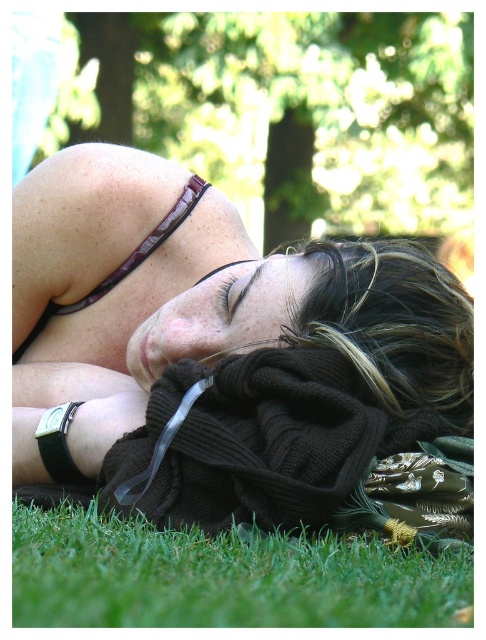
You are a photographer setting up for a portrait and need to position a matte black sweater at center. According to the scene, where exactly should you place it?

The matte black sweater at center should be placed at point (194, 304) as specified in the scene description.

You are a photographer trying to capture the perfect shot of the person resting. To ensure the sweater and grass are both visible in the frame, you need to adjust your camera settings. Since the matte black sweater at center is larger than the green soft grass at lower left, which object should you focus on first to ensure depth of field?

The matte black sweater at center should be focused on first because it is larger and closer to the camera, ensuring both it and the green soft grass at lower left remain in focus.

You are a photographer trying to capture the scene from above. You want to ensure the matte black sweater at center and the green soft grass at lower left are both visible in the frame. Which object should you focus on first to ensure both are in focus?

The green soft grass at lower left is behind the matte black sweater at center, so you should focus on the matte black sweater at center first to ensure both are in focus.